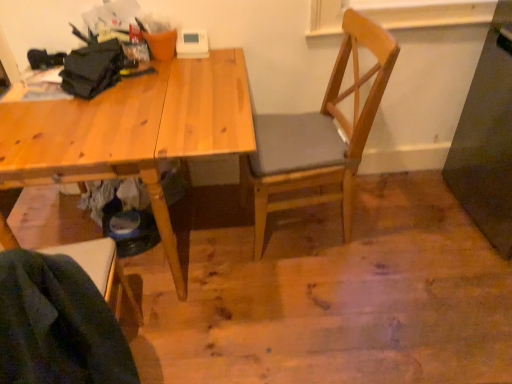
Question: Can you confirm if natural wood desk at upper left is shorter than wooden chair at center, the 2th chair from the front?

Choices:
 (A) yes
 (B) no

Answer: (A)

Question: Is natural wood desk at upper left next to wooden chair at center, the 2th chair from the front?

Choices:
 (A) yes
 (B) no

Answer: (B)

Question: Is natural wood desk at upper left positioned behind wooden chair at center, arranged as the 1th chair when viewed from the back?

Choices:
 (A) no
 (B) yes

Answer: (A)

Question: Does natural wood desk at upper left come in front of wooden chair at center, placed as the 1th chair when sorted from right to left?

Choices:
 (A) yes
 (B) no

Answer: (A)

Question: Considering the relative sizes of natural wood desk at upper left and wooden chair at center, arranged as the 1th chair when viewed from the back, in the image provided, is natural wood desk at upper left thinner than wooden chair at center, arranged as the 1th chair when viewed from the back,?

Choices:
 (A) yes
 (B) no

Answer: (B)

Question: Does natural wood desk at upper left have a greater height compared to wooden chair at center, the 2th chair from the front?

Choices:
 (A) no
 (B) yes

Answer: (A)

Question: Is the depth of wooden chair at center, placed as the 1th chair when sorted from right to left, greater than that of natural wood desk at upper left?

Choices:
 (A) no
 (B) yes

Answer: (B)

Question: Is wooden chair at center, acting as the 2th chair starting from the left, shorter than natural wood desk at upper left?

Choices:
 (A) no
 (B) yes

Answer: (A)

Question: Considering the relative sizes of wooden chair at center, acting as the 2th chair starting from the left, and natural wood desk at upper left in the image provided, is wooden chair at center, acting as the 2th chair starting from the left, bigger than natural wood desk at upper left?

Choices:
 (A) yes
 (B) no

Answer: (B)

Question: Is wooden chair at center, the 2th chair from the front, beside natural wood desk at upper left?

Choices:
 (A) no
 (B) yes

Answer: (A)

Question: From a real-world perspective, is wooden chair at center, arranged as the 1th chair when viewed from the back, on natural wood desk at upper left?

Choices:
 (A) no
 (B) yes

Answer: (B)

Question: Does wooden chair at center, the 2th chair from the front, appear on the left side of natural wood desk at upper left?

Choices:
 (A) yes
 (B) no

Answer: (B)

Question: Is wooden chair at lower left, the first chair in the front-to-back sequence, wider than wooden chair at center, the 2th chair from the front?

Choices:
 (A) no
 (B) yes

Answer: (A)